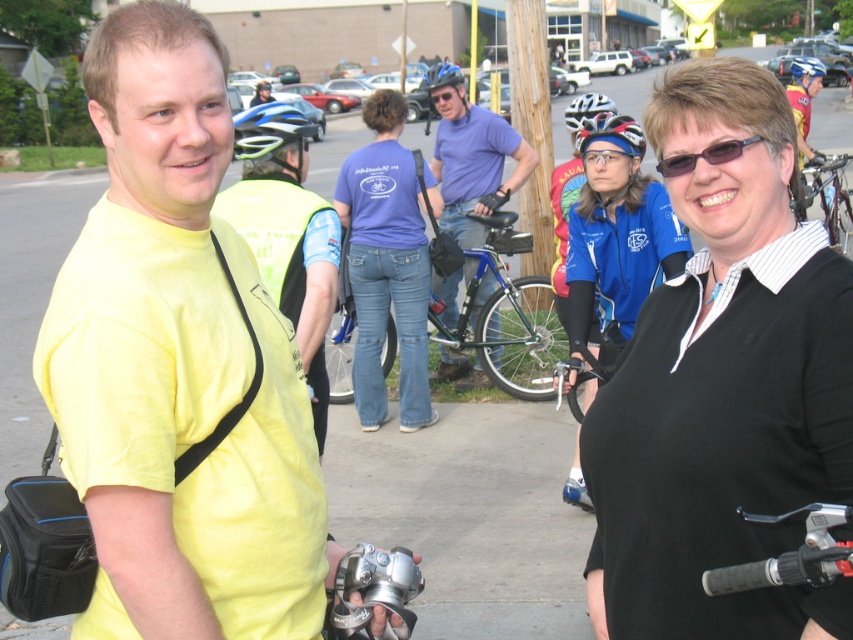
Does yellow matte shirt at center have a larger size compared to blue jersey at center?

No.

Looking at this image, is yellow matte shirt at center closer to camera compared to blue jersey at center?

Yes, yellow matte shirt at center is closer to the viewer.

Image resolution: width=853 pixels, height=640 pixels. Identify the location of yellow matte shirt at center. (178, 365).

The image size is (853, 640). Identify the location of yellow matte shirt at center. (178, 365).

Is point (635, 125) positioned after point (712, 156)?

Yes.

Which is in front, point (610, 134) or point (668, 163)?

Positioned in front is point (668, 163).

Locate an element on the screen. shiny black helmet at center is located at coordinates (611, 132).

Between blue jersey at center and shiny blue helmet at center, which one has less height?

blue jersey at center is shorter.

Can you confirm if blue jersey at center is smaller than shiny blue helmet at center?

Correct, blue jersey at center occupies less space than shiny blue helmet at center.

Which is in front, point (595, 301) or point (283, 132)?

Point (283, 132) is in front.

At what (x,y) coordinates should I click in order to perform the action: click on blue jersey at center. Please return your answer as a coordinate pair (x, y). Looking at the image, I should click on (616, 236).